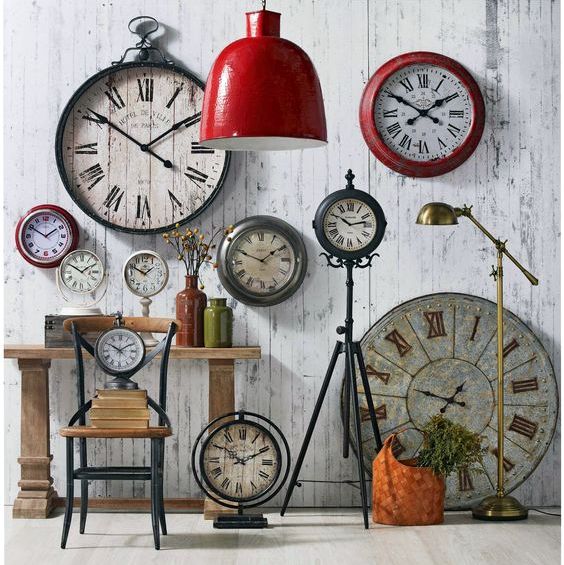
Locate an element on the screen. The width and height of the screenshot is (564, 565). clocks is located at coordinates (118, 144), (420, 102), (446, 367), (342, 226), (250, 258), (230, 464), (129, 343), (146, 279), (87, 269), (47, 231).